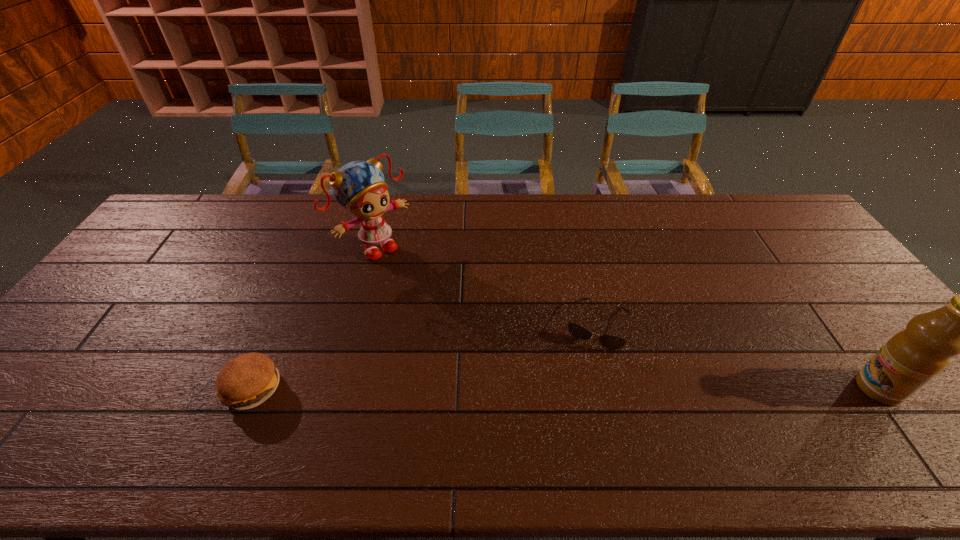
This screenshot has height=540, width=960. What are the coordinates of `blank area in the image that satisfies the following two spatial constraints: 1. on the front side of the doll; 2. on the label of the olive oil` in the screenshot? It's located at (337, 388).

The image size is (960, 540). Find the location of `free space that satisfies the following two spatial constraints: 1. on the front side of the rightmost object; 2. on the label of the farthest object`. free space that satisfies the following two spatial constraints: 1. on the front side of the rightmost object; 2. on the label of the farthest object is located at coordinates (337, 388).